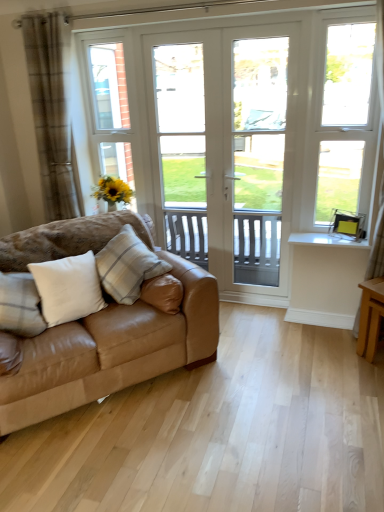
Question: From the image's perspective, relative to white soft pillow at lower left, the third pillow viewed from the right, is white plastic window at right above or below?

Choices:
 (A) above
 (B) below

Answer: (A)

Question: Looking at their shapes, would you say white plastic window at right is wider or thinner than white soft pillow at lower left, which is the 1th pillow from left to right?

Choices:
 (A) wide
 (B) thin

Answer: (B)

Question: Which of these objects is positioned farthest from the white textured pillow at center, acting as the third pillow starting from the left?

Choices:
 (A) tan leather couch at left
 (B) light brown wood table at lower right
 (C) white soft pillow at lower left, the third pillow viewed from the right
 (D) brown plaid curtain at left
 (E) white soft cushion at left, acting as the 2th pillow starting from the left

Answer: (B)

Question: Estimate the real-world distances between objects in this image. Which object is closer to the brown plaid curtain at left?

Choices:
 (A) white soft pillow at lower left, the third pillow viewed from the right
 (B) white plastic window at right
 (C) tan leather couch at left
 (D) white glossy door at center
 (E) white textured pillow at center, acting as the third pillow starting from the left

Answer: (E)